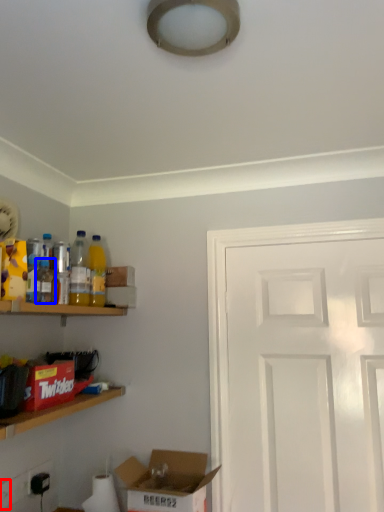
Question: Which object is further to the camera taking this photo, electric outlet (highlighted by a red box) or bottle (highlighted by a blue box)?

Choices:
 (A) electric outlet
 (B) bottle

Answer: (A)